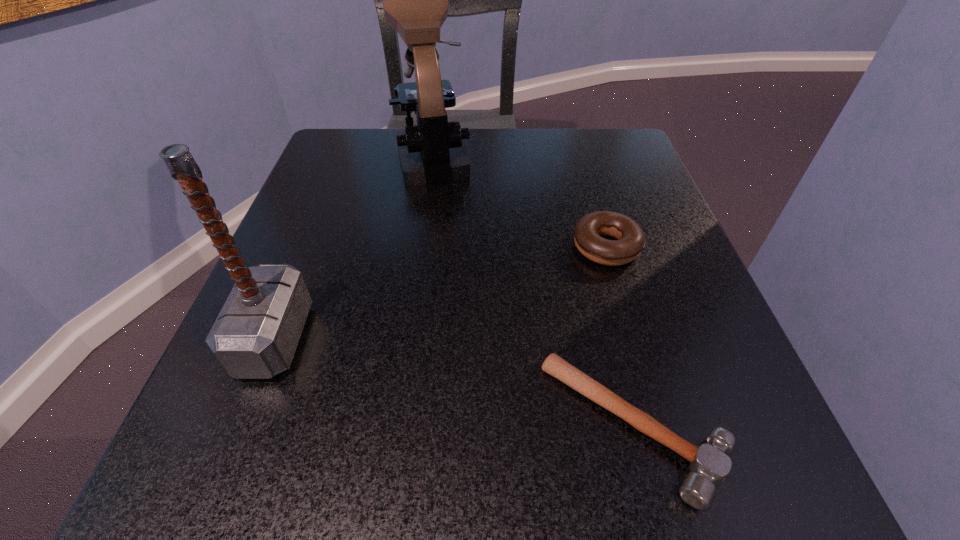
Locate an element on the screen. vacant position at the near edge of the desktop is located at coordinates (574, 439).

In the image, there is a desktop. In order to click on free space at the left edge in this screenshot , I will do `click(320, 377)`.

The width and height of the screenshot is (960, 540). In the image, there is a desktop. Identify the location of vacant space at the right edge. (716, 355).

I want to click on vacant space at the far left corner of the desktop, so click(321, 171).

Where is `vacant space at the near left corner of the desktop`? The height and width of the screenshot is (540, 960). vacant space at the near left corner of the desktop is located at coordinates (290, 500).

This screenshot has width=960, height=540. I want to click on vacant area at the far right corner of the desktop, so [x=623, y=158].

In order to click on vacant point located between the right hammer and the leftmost object in this screenshot , I will do `click(454, 382)`.

Locate an element on the screen. This screenshot has height=540, width=960. unoccupied position between the shorter hammer and the taller hammer is located at coordinates coord(454,382).

Locate an element on the screen. This screenshot has width=960, height=540. free space between the second farthest object and the left hammer is located at coordinates (441, 293).

At what (x,y) coordinates should I click in order to perform the action: click on vacant area between the third tallest object and the shortest object. Please return your answer as a coordinate pair (x, y). Image resolution: width=960 pixels, height=540 pixels. Looking at the image, I should click on (620, 337).